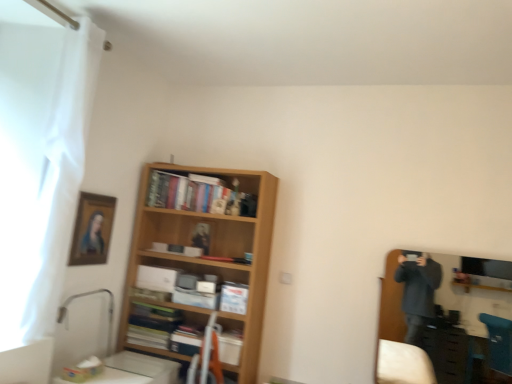
Question: Should I look upward or downward to see wooden bookshelf at center?

Choices:
 (A) up
 (B) down

Answer: (B)

Question: Is wooden bookshelf at center at the back of white sheer curtain at left?

Choices:
 (A) no
 (B) yes

Answer: (A)

Question: Is white sheer curtain at left smaller than wooden bookshelf at center?

Choices:
 (A) no
 (B) yes

Answer: (B)

Question: Is white sheer curtain at left positioned in front of wooden bookshelf at center?

Choices:
 (A) no
 (B) yes

Answer: (B)

Question: Can you see white sheer curtain at left touching wooden bookshelf at center?

Choices:
 (A) yes
 (B) no

Answer: (B)

Question: Is white sheer curtain at left wider than wooden bookshelf at center?

Choices:
 (A) no
 (B) yes

Answer: (A)

Question: Is white sheer curtain at left at the left side of wooden bookshelf at center?

Choices:
 (A) no
 (B) yes

Answer: (B)

Question: Does wooden bookshelf at center, which is the second book in bottom-to-top order, come behind wooden bookshelf at center?

Choices:
 (A) no
 (B) yes

Answer: (B)

Question: Is wooden bookshelf at center, positioned as the 1th book in back-to-front order, located outside wooden bookshelf at center?

Choices:
 (A) no
 (B) yes

Answer: (A)

Question: Can you confirm if wooden bookshelf at center, positioned as the 1th book in back-to-front order, is shorter than wooden bookshelf at center?

Choices:
 (A) no
 (B) yes

Answer: (B)

Question: Can you confirm if wooden bookshelf at center, which is the second book in bottom-to-top order, is wider than wooden bookshelf at center?

Choices:
 (A) no
 (B) yes

Answer: (A)

Question: Is wooden bookshelf at center, positioned as the 1th book in back-to-front order, looking in the opposite direction of wooden bookshelf at center?

Choices:
 (A) no
 (B) yes

Answer: (B)

Question: From the image's perspective, is wooden bookshelf at center, marked as the 2th book in a front-to-back arrangement, on top of wooden bookshelf at center?

Choices:
 (A) no
 (B) yes

Answer: (B)

Question: Considering the relative positions of wooden bookshelf at center and wooden entertainment center at right in the image provided, is wooden bookshelf at center to the left of wooden entertainment center at right from the viewer's perspective?

Choices:
 (A) yes
 (B) no

Answer: (A)